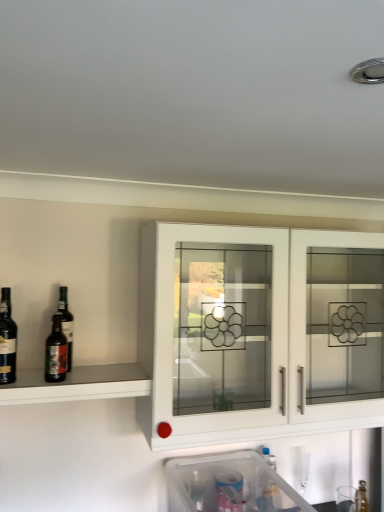
Question: Can you confirm if white glossy cabinet at center is taller than clear glass bottle at lower right?

Choices:
 (A) yes
 (B) no

Answer: (A)

Question: Is white glossy cabinet at center with clear glass bottle at lower right?

Choices:
 (A) yes
 (B) no

Answer: (B)

Question: Is white glossy cabinet at center closer to the viewer compared to clear glass bottle at lower right?

Choices:
 (A) yes
 (B) no

Answer: (A)

Question: Can you confirm if white glossy cabinet at center is shorter than clear glass bottle at lower right?

Choices:
 (A) yes
 (B) no

Answer: (B)

Question: Is white glossy cabinet at center at the left side of clear glass bottle at lower right?

Choices:
 (A) yes
 (B) no

Answer: (A)

Question: Considering the positions of point (3, 304) and point (365, 494), is point (3, 304) closer or farther from the camera than point (365, 494)?

Choices:
 (A) closer
 (B) farther

Answer: (A)

Question: Considering the relative positions of dark brown glass bottle at left, which appears as the 2th wine when viewed from the right, and clear glass bottle at lower right in the image provided, is dark brown glass bottle at left, which appears as the 2th wine when viewed from the right, to the left or to the right of clear glass bottle at lower right?

Choices:
 (A) left
 (B) right

Answer: (A)

Question: Would you say dark brown glass bottle at left, placed as the first wine when sorted from left to right, is inside or outside clear glass bottle at lower right?

Choices:
 (A) outside
 (B) inside

Answer: (A)

Question: Based on their sizes in the image, would you say dark brown glass bottle at left, which appears as the 2th wine when viewed from the right, is bigger or smaller than clear glass bottle at lower right?

Choices:
 (A) small
 (B) big

Answer: (B)

Question: Is point (62, 346) positioned closer to the camera than point (360, 504)?

Choices:
 (A) closer
 (B) farther

Answer: (A)

Question: In the image, is dark brown glass bottle at left, which is the second wine from left to right, positioned in front of or behind clear glass bottle at lower right?

Choices:
 (A) behind
 (B) front

Answer: (B)

Question: In terms of height, does dark brown glass bottle at left, arranged as the first wine when viewed from the right, look taller or shorter compared to clear glass bottle at lower right?

Choices:
 (A) short
 (B) tall

Answer: (B)

Question: Based on their sizes in the image, would you say dark brown glass bottle at left, which is the second wine from left to right, is bigger or smaller than clear glass bottle at lower right?

Choices:
 (A) big
 (B) small

Answer: (A)

Question: Considering the positions of clear glass bottle at lower right and white glossy cabinet at center in the image, is clear glass bottle at lower right taller or shorter than white glossy cabinet at center?

Choices:
 (A) tall
 (B) short

Answer: (B)

Question: Looking at their shapes, would you say clear glass bottle at lower right is wider or thinner than white glossy cabinet at center?

Choices:
 (A) wide
 (B) thin

Answer: (B)